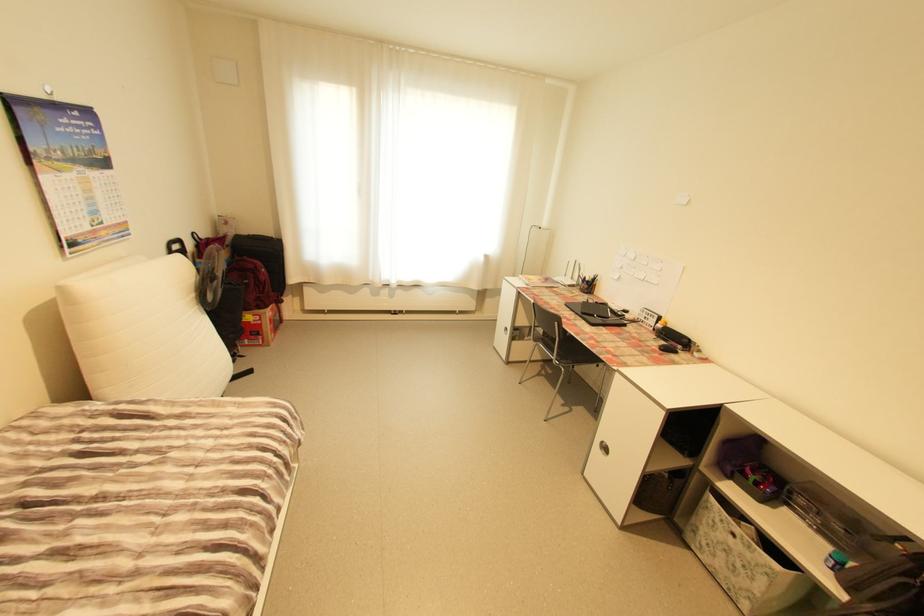
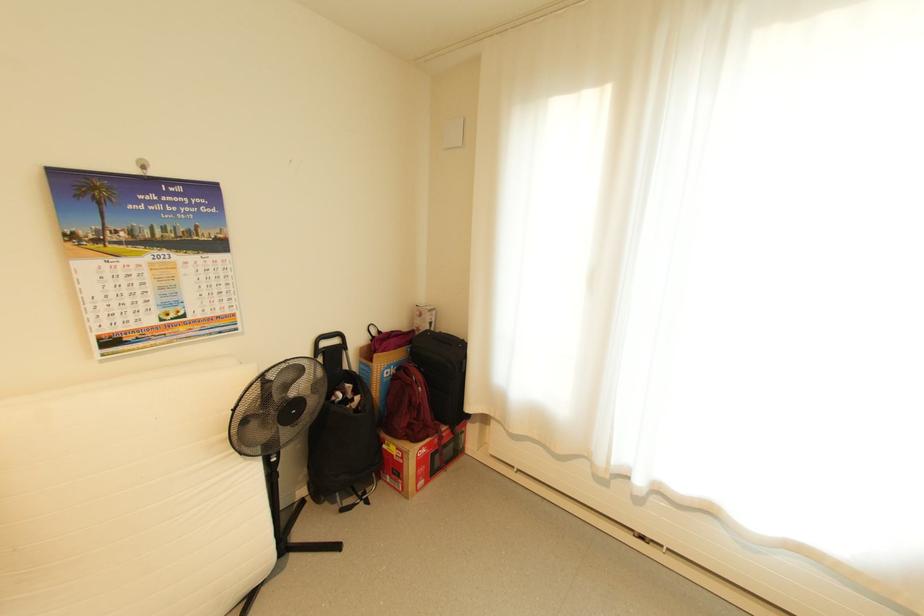
The point at (237, 235) is marked in the first image. Where is the corresponding point in the second image?

(429, 330)